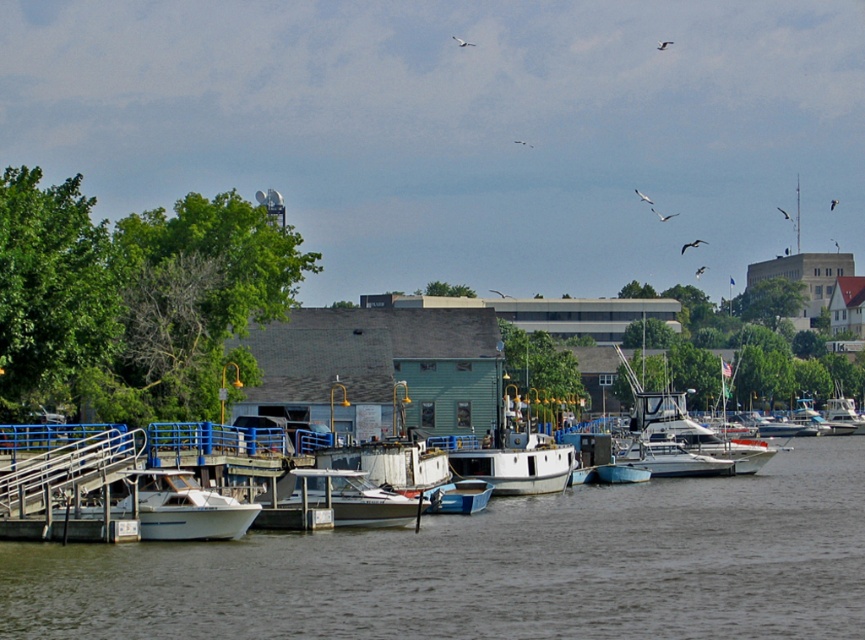
Is white glossy boat at lower left above metallic blue boat at center?

Indeed, white glossy boat at lower left is positioned over metallic blue boat at center.

Which of these two, white glossy boat at lower left or metallic blue boat at center, stands taller?

white glossy boat at lower left is taller.

At what (x,y) coordinates should I click in order to perform the action: click on white glossy boat at lower left. Please return your answer as a coordinate pair (x, y). The height and width of the screenshot is (640, 865). Looking at the image, I should click on (186, 508).

Image resolution: width=865 pixels, height=640 pixels. I want to click on white glossy boat at lower left, so click(186, 508).

Which of these two, white matte water at center or metallic blue boat at center, stands taller?

With more height is white matte water at center.

Is point (804, 602) positioned behind point (428, 499)?

No, it is not.

Who is more forward, (863, 557) or (447, 486)?

Point (863, 557)

The image size is (865, 640). Find the location of `white matte water at center`. white matte water at center is located at coordinates pyautogui.click(x=494, y=566).

In the scene shown: Between white glossy boat at lower left and white glossy boat at center, which one is positioned higher?

white glossy boat at lower left is higher up.

Between point (180, 518) and point (286, 497), which one is positioned behind?

Point (286, 497)

I want to click on white glossy boat at lower left, so (186, 508).